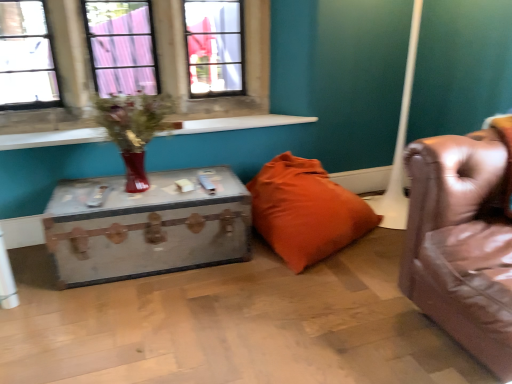
Where is `vacant space in front of orange fabric pillow at center`? This screenshot has height=384, width=512. vacant space in front of orange fabric pillow at center is located at coordinates (306, 307).